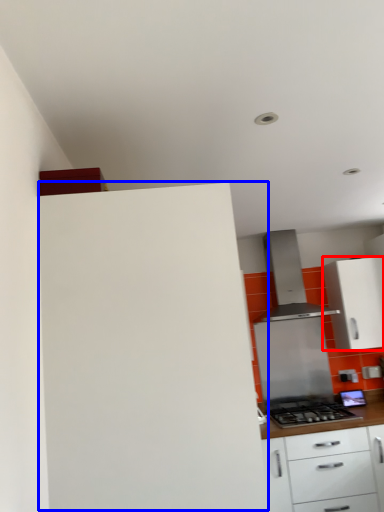
Question: Which point is closer to the camera, cabinetry (highlighted by a red box) or cabinetry (highlighted by a blue box)?

Choices:
 (A) cabinetry
 (B) cabinetry

Answer: (B)